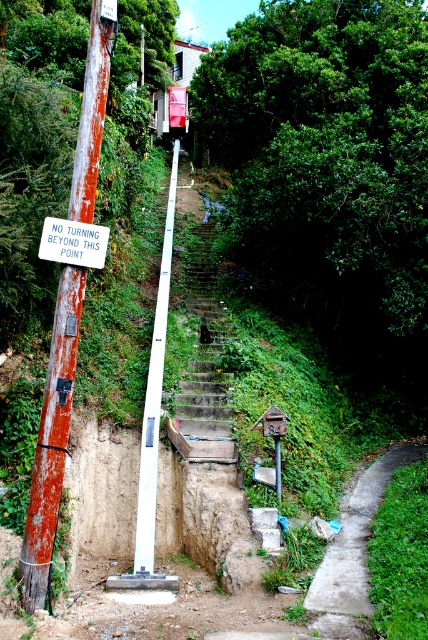
Does rusty metal pole at left have a lesser height compared to concrete path at lower right?

No.

Which is in front, point (50, 404) or point (341, 632)?

Point (341, 632) is more forward.

The height and width of the screenshot is (640, 428). In order to click on rusty metal pole at left in this screenshot , I will do `click(51, 440)`.

Between green mossy stairs at center and white plastic pole at center, which one appears on the right side from the viewer's perspective?

green mossy stairs at center

This screenshot has height=640, width=428. Identify the location of green mossy stairs at center. (202, 416).

Does point (193, 394) come behind point (148, 518)?

Yes, it is.

This screenshot has height=640, width=428. I want to click on green mossy stairs at center, so click(x=202, y=416).

Can you confirm if rusty metal pole at left is bigger than green mossy stairs at center?

Indeed, rusty metal pole at left has a larger size compared to green mossy stairs at center.

What are the coordinates of `rusty metal pole at left` in the screenshot? It's located at (51, 440).

Describe the element at coordinates (51, 440) in the screenshot. I see `rusty metal pole at left` at that location.

Where is `rusty metal pole at left`? rusty metal pole at left is located at coordinates (51, 440).